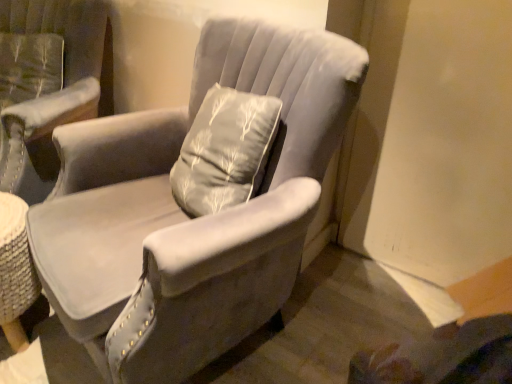
What are the coordinates of `velvet gray armchair at center, arranged as the 2th chair when viewed from the left` in the screenshot? It's located at (188, 215).

What do you see at coordinates (188, 215) in the screenshot? The width and height of the screenshot is (512, 384). I see `velvet gray armchair at center, arranged as the 2th chair when viewed from the left` at bounding box center [188, 215].

What is the approximate width of velvet gray armchair at upper left, the 2th chair from the right?

velvet gray armchair at upper left, the 2th chair from the right, is 11.78 inches in width.

Describe the element at coordinates (51, 93) in the screenshot. Image resolution: width=512 pixels, height=384 pixels. I see `velvet gray armchair at upper left, the 2th chair from the right` at that location.

The width and height of the screenshot is (512, 384). In order to click on velvet gray armchair at upper left, the first chair from the left in this screenshot , I will do `click(51, 93)`.

The height and width of the screenshot is (384, 512). I want to click on velvet gray armchair at center, arranged as the 2th chair when viewed from the left, so click(188, 215).

Between velvet gray armchair at center, positioned as the 1th chair in right-to-left order, and velvet gray armchair at upper left, the 2th chair from the right, which one appears on the left side from the viewer's perspective?

velvet gray armchair at upper left, the 2th chair from the right, is more to the left.

Which object is closer to the camera taking this photo, velvet gray armchair at center, arranged as the 2th chair when viewed from the left, or velvet gray armchair at upper left, the first chair from the left?

Positioned in front is velvet gray armchair at center, arranged as the 2th chair when viewed from the left.

Which is less distant, (163,173) or (60,29)?

Point (163,173)

From the image's perspective, is velvet gray armchair at center, positioned as the 1th chair in right-to-left order, on top of velvet gray armchair at upper left, the 2th chair from the right?

No, from the image's perspective, velvet gray armchair at center, positioned as the 1th chair in right-to-left order, is not on top of velvet gray armchair at upper left, the 2th chair from the right.

From a real-world perspective, is velvet gray armchair at center, arranged as the 2th chair when viewed from the left, on velvet gray armchair at upper left, the 2th chair from the right?

Actually, velvet gray armchair at center, arranged as the 2th chair when viewed from the left, is physically below velvet gray armchair at upper left, the 2th chair from the right, in the real world.

Considering the sizes of velvet gray armchair at center, positioned as the 1th chair in right-to-left order, and velvet gray armchair at upper left, the first chair from the left, in the image, is velvet gray armchair at center, positioned as the 1th chair in right-to-left order, wider or thinner than velvet gray armchair at upper left, the first chair from the left,?

Considering their sizes, velvet gray armchair at center, positioned as the 1th chair in right-to-left order, looks broader than velvet gray armchair at upper left, the first chair from the left.

Can you confirm if velvet gray armchair at center, arranged as the 2th chair when viewed from the left, is taller than velvet gray armchair at upper left, the 2th chair from the right?

Yes, velvet gray armchair at center, arranged as the 2th chair when viewed from the left, is taller than velvet gray armchair at upper left, the 2th chair from the right.

Can you confirm if velvet gray armchair at center, arranged as the 2th chair when viewed from the left, is smaller than velvet gray armchair at upper left, the 2th chair from the right?

No.

Is velvet gray armchair at center, arranged as the 2th chair when viewed from the left, positioned beyond the bounds of velvet gray armchair at upper left, the first chair from the left?

That's correct, velvet gray armchair at center, arranged as the 2th chair when viewed from the left, is outside of velvet gray armchair at upper left, the first chair from the left.

Is velvet gray armchair at center, arranged as the 2th chair when viewed from the left, far away from velvet gray armchair at upper left, the first chair from the left?

They are positioned close to each other.

Is velvet gray armchair at center, arranged as the 2th chair when viewed from the left, facing towards velvet gray armchair at upper left, the first chair from the left?

No, velvet gray armchair at center, arranged as the 2th chair when viewed from the left, is not aimed at velvet gray armchair at upper left, the first chair from the left.

Measure the distance from velvet gray armchair at center, positioned as the 1th chair in right-to-left order, to velvet gray armchair at upper left, the 2th chair from the right.

24.27 inches.

The width and height of the screenshot is (512, 384). In the image, there is a velvet gray armchair at center, positioned as the 1th chair in right-to-left order. Find the location of `chair above it (from the image's perspective)`. chair above it (from the image's perspective) is located at coordinates (51, 93).

Would you say velvet gray armchair at upper left, the 2th chair from the right, is to the left or to the right of velvet gray armchair at center, arranged as the 2th chair when viewed from the left, in the picture?

Clearly, velvet gray armchair at upper left, the 2th chair from the right, is on the left of velvet gray armchair at center, arranged as the 2th chair when viewed from the left, in the image.

Which object is closer to the camera, velvet gray armchair at upper left, the 2th chair from the right, or velvet gray armchair at center, positioned as the 1th chair in right-to-left order?

velvet gray armchair at center, positioned as the 1th chair in right-to-left order, is more forward.

Is point (56, 27) closer or farther from the camera than point (97, 156)?

Point (56, 27).

From the image's perspective, is velvet gray armchair at upper left, the first chair from the left, located above velvet gray armchair at center, positioned as the 1th chair in right-to-left order?

Correct, velvet gray armchair at upper left, the first chair from the left, appears higher than velvet gray armchair at center, positioned as the 1th chair in right-to-left order, in the image.

From a real-world perspective, between velvet gray armchair at upper left, the 2th chair from the right, and velvet gray armchair at center, positioned as the 1th chair in right-to-left order, who is vertically lower?

In real-world perspective, velvet gray armchair at center, positioned as the 1th chair in right-to-left order, is lower.

Which of these two, velvet gray armchair at upper left, the 2th chair from the right, or velvet gray armchair at center, positioned as the 1th chair in right-to-left order, is thinner?

velvet gray armchair at upper left, the 2th chair from the right.

Who is shorter, velvet gray armchair at upper left, the 2th chair from the right, or velvet gray armchair at center, arranged as the 2th chair when viewed from the left?

velvet gray armchair at upper left, the 2th chair from the right.

Looking at the image, does velvet gray armchair at upper left, the first chair from the left, seem bigger or smaller compared to velvet gray armchair at center, positioned as the 1th chair in right-to-left order?

In the image, velvet gray armchair at upper left, the first chair from the left, appears to be smaller than velvet gray armchair at center, positioned as the 1th chair in right-to-left order.

Is velvet gray armchair at upper left, the 2th chair from the right, located outside velvet gray armchair at center, positioned as the 1th chair in right-to-left order?

velvet gray armchair at upper left, the 2th chair from the right, is positioned outside velvet gray armchair at center, positioned as the 1th chair in right-to-left order.

Is the surface of velvet gray armchair at upper left, the first chair from the left, in direct contact with velvet gray armchair at center, arranged as the 2th chair when viewed from the left?

No, velvet gray armchair at upper left, the first chair from the left, is not next to velvet gray armchair at center, arranged as the 2th chair when viewed from the left.

Is velvet gray armchair at upper left, the 2th chair from the right, facing away from velvet gray armchair at center, arranged as the 2th chair when viewed from the left?

No.

Can you tell me how much velvet gray armchair at upper left, the first chair from the left, and velvet gray armchair at center, arranged as the 2th chair when viewed from the left, differ in facing direction?

The angle between the facing direction of velvet gray armchair at upper left, the first chair from the left, and the facing direction of velvet gray armchair at center, arranged as the 2th chair when viewed from the left, is 37 degrees.

The image size is (512, 384). I want to click on chair above the velvet gray armchair at center, arranged as the 2th chair when viewed from the left (from the image's perspective), so click(x=51, y=93).

Identify the location of chair on the left of velvet gray armchair at center, arranged as the 2th chair when viewed from the left. (51, 93).

You are a GUI agent. You are given a task and a screenshot of the screen. Output one action in this format:
    pyautogui.click(x=<x>, y=<y>)
    Task: Click on the chair on the right of velvet gray armchair at upper left, the 2th chair from the right
    The image size is (512, 384).
    Given the screenshot: What is the action you would take?
    pyautogui.click(x=188, y=215)